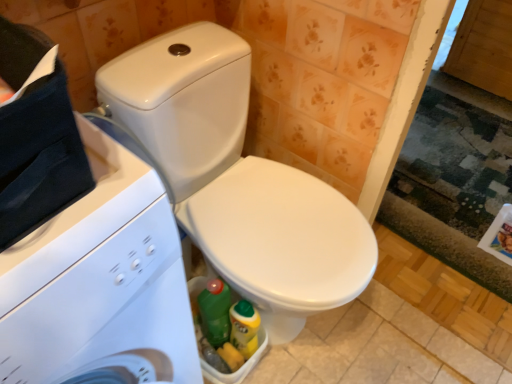
Where is `white glossy toilet at center`? white glossy toilet at center is located at coordinates (238, 179).

Measure the distance between white glossy toilet at center and camera.

33.23 inches.

What is the approximate height of white glossy toilet at center?

It is 30.07 inches.

The height and width of the screenshot is (384, 512). What do you see at coordinates (238, 179) in the screenshot?
I see `white glossy toilet at center` at bounding box center [238, 179].

What is the approximate width of white glossy washing machine at left?

white glossy washing machine at left is 21.25 inches in width.

Describe the element at coordinates (100, 282) in the screenshot. I see `white glossy washing machine at left` at that location.

At what (x,y) coordinates should I click in order to perform the action: click on white glossy washing machine at left. Please return your answer as a coordinate pair (x, y). This screenshot has height=384, width=512. Looking at the image, I should click on (100, 282).

Measure the distance between white glossy washing machine at left and camera.

white glossy washing machine at left and camera are 16.26 inches apart from each other.

This screenshot has height=384, width=512. In order to click on white glossy toilet at center in this screenshot , I will do `click(238, 179)`.

Based on their positions, is white glossy toilet at center located to the left or right of white glossy washing machine at left?

From the image, it's evident that white glossy toilet at center is to the right of white glossy washing machine at left.

Which object is more forward, white glossy toilet at center or white glossy washing machine at left?

white glossy washing machine at left is more forward.

Which point is more forward, (154,72) or (136,274)?

The point (136,274) is closer to the camera.

Looking at this image, from the image's perspective, which object appears higher, white glossy toilet at center or white glossy washing machine at left?

From the image's view, white glossy toilet at center is above.

From a real-world perspective, relative to white glossy washing machine at left, is white glossy toilet at center vertically above or below?

Clearly, from a real-world perspective, white glossy toilet at center is below white glossy washing machine at left.

Looking at this image, which object is wider, white glossy toilet at center or white glossy washing machine at left?

white glossy toilet at center is wider.

From their relative heights in the image, would you say white glossy toilet at center is taller or shorter than white glossy washing machine at left?

Considering their sizes, white glossy toilet at center has less height than white glossy washing machine at left.

Considering the sizes of objects white glossy toilet at center and white glossy washing machine at left in the image provided, who is smaller, white glossy toilet at center or white glossy washing machine at left?

With smaller size is white glossy washing machine at left.

Is white glossy toilet at center outside of white glossy washing machine at left?

Yes, white glossy toilet at center is not within white glossy washing machine at left.

Is white glossy toilet at center next to white glossy washing machine at left and touching it?

No, white glossy toilet at center is not next to white glossy washing machine at left.

Is white glossy toilet at center looking in the opposite direction of white glossy washing machine at left?

That's not correct — white glossy toilet at center is not looking away from white glossy washing machine at left.

How different are the orientations of white glossy toilet at center and white glossy washing machine at left in degrees?

The angle between the facing direction of white glossy toilet at center and the facing direction of white glossy washing machine at left is 3.49 degrees.

Identify the location of toilet that is on the right side of white glossy washing machine at left. The height and width of the screenshot is (384, 512). (238, 179).

Consider the image. Considering the relative positions of white glossy washing machine at left and white glossy toilet at center in the image provided, is white glossy washing machine at left to the left or to the right of white glossy toilet at center?

In the image, white glossy washing machine at left appears on the left side of white glossy toilet at center.

Is white glossy washing machine at left closer to the viewer compared to white glossy toilet at center?

Yes, white glossy washing machine at left is closer to the camera.

Which is closer to the camera, (151, 330) or (146, 119)?

Positioned in front is point (151, 330).

Looking at this image, from the image's perspective, is white glossy washing machine at left located above or below white glossy toilet at center?

From the image's perspective, white glossy washing machine at left appears below white glossy toilet at center.

From a real-world perspective, is white glossy washing machine at left over white glossy toilet at center?

Yes, from a real-world perspective, white glossy washing machine at left is over white glossy toilet at center

Which of these two, white glossy washing machine at left or white glossy toilet at center, is wider?

With larger width is white glossy toilet at center.

Is white glossy washing machine at left shorter than white glossy toilet at center?

In fact, white glossy washing machine at left may be taller than white glossy toilet at center.

Does white glossy washing machine at left have a larger size compared to white glossy toilet at center?

No, white glossy washing machine at left is not bigger than white glossy toilet at center.

Is white glossy washing machine at left positioned beyond the bounds of white glossy toilet at center?

white glossy washing machine at left is positioned outside white glossy toilet at center.

Would you consider white glossy washing machine at left to be distant from white glossy toilet at center?

No.

Is white glossy washing machine at left looking in the opposite direction of white glossy toilet at center?

No, white glossy washing machine at left's orientation is not away from white glossy toilet at center.

I want to click on toilet below the white glossy washing machine at left (from a real-world perspective), so click(238, 179).

Locate an element on the screen. This screenshot has width=512, height=384. toilet behind the white glossy washing machine at left is located at coordinates (238, 179).

Locate an element on the screen. The width and height of the screenshot is (512, 384). washing machine on the left of the white glossy toilet at center is located at coordinates (100, 282).